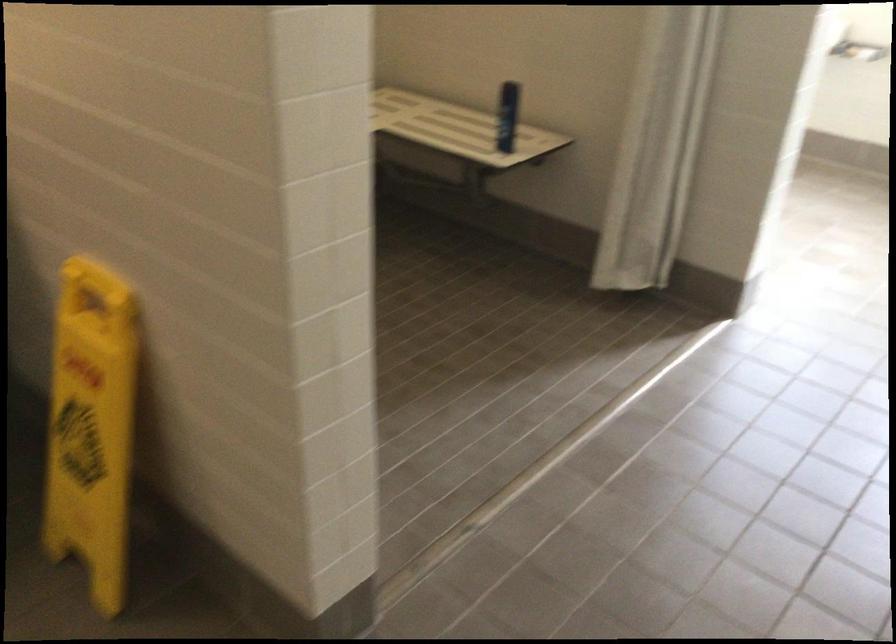
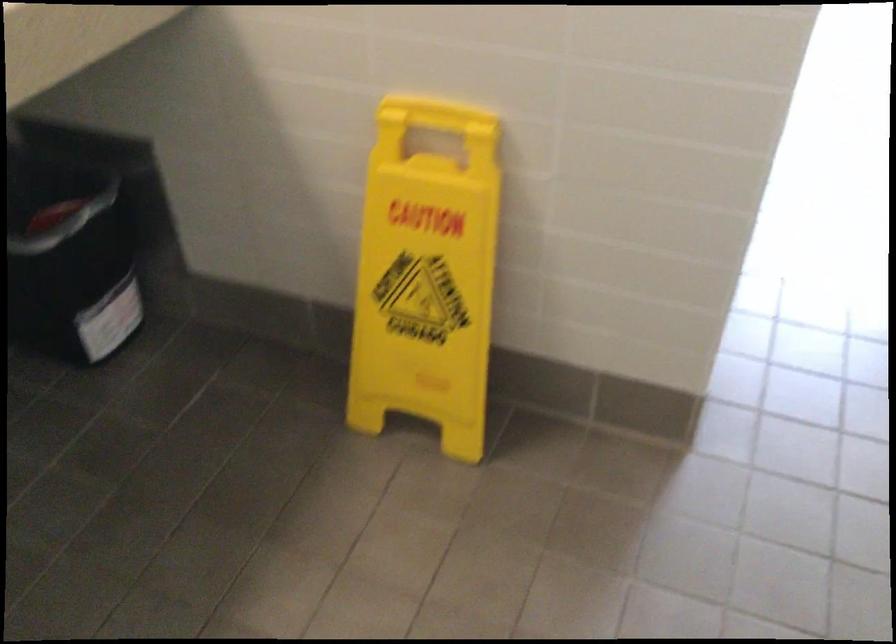
Where in the second image is the point corresponding to point (99, 277) from the first image?

(429, 114)